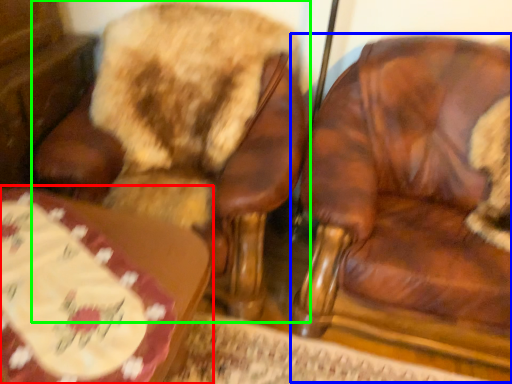
Question: Based on their relative distances, which object is farther from table (highlighted by a red box)? Choose from chair (highlighted by a blue box) and chair (highlighted by a green box).

Choices:
 (A) chair
 (B) chair

Answer: (A)